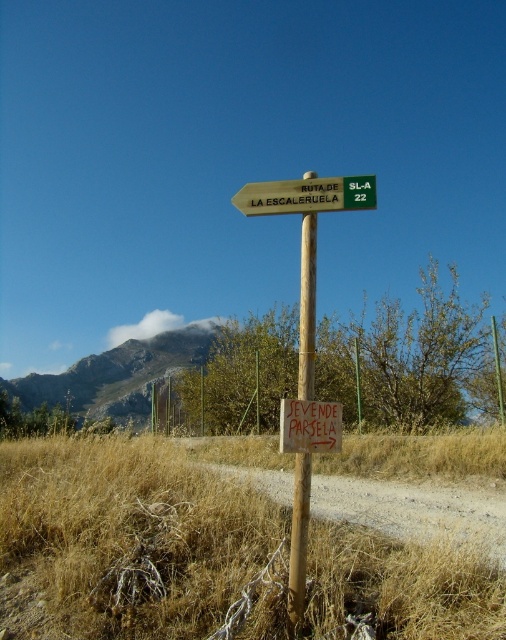
Does dry straw at lower center come in front of brown wooden pole at center?

Yes, it is.

Can you confirm if dry straw at lower center is positioned below brown wooden pole at center?

→ Correct, dry straw at lower center is located below brown wooden pole at center.

Which is behind, point (23, 548) or point (298, 387)?

Positioned behind is point (23, 548).

Locate an element on the screen. dry straw at lower center is located at coordinates (x=141, y=540).

What do you see at coordinates (416, 493) in the screenshot? The width and height of the screenshot is (506, 640). I see `brown dirt track at center` at bounding box center [416, 493].

Does brown dirt track at center appear on the left side of green plastic signpost at center?

No, brown dirt track at center is not to the left of green plastic signpost at center.

Measure the distance between point (246, 465) and camera.

A distance of 12.21 meters exists between point (246, 465) and camera.

Locate an element on the screen. The image size is (506, 640). brown dirt track at center is located at coordinates (416, 493).

Between dry straw at lower center and white paper sign at center, which one has less height?

With less height is white paper sign at center.

Locate an element on the screen. dry straw at lower center is located at coordinates (141, 540).

You are a GUI agent. You are given a task and a screenshot of the screen. Output one action in this format:
    pyautogui.click(x=<x>, y=<y>)
    Task: Click on the dry straw at lower center
    This screenshot has width=506, height=640.
    Given the screenshot: What is the action you would take?
    pyautogui.click(x=141, y=540)